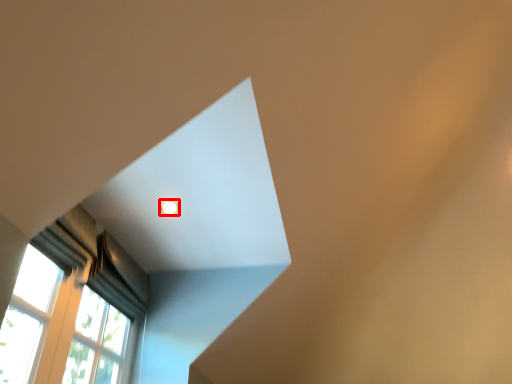
Question: In this image, where is lighting (annotated by the red box) located relative to curtain?

Choices:
 (A) right
 (B) left

Answer: (A)